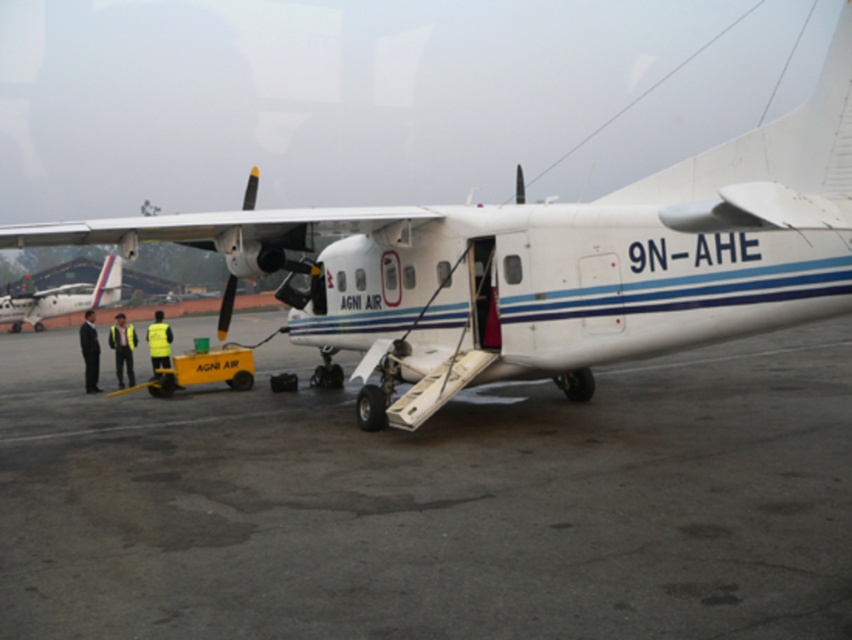
Can you confirm if white matte airplane at center is thinner than yellow reflective vest at center?

In fact, white matte airplane at center might be wider than yellow reflective vest at center.

Is white matte airplane at center to the right of yellow reflective vest at center from the viewer's perspective?

Yes, white matte airplane at center is to the right of yellow reflective vest at center.

Between point (709, 250) and point (165, 337), which one is positioned behind?

The point (165, 337) is more distant.

Locate an element on the screen. This screenshot has height=640, width=852. white matte airplane at center is located at coordinates (545, 262).

Does yellow reflective vest at left have a greater height compared to black suit at left?

In fact, yellow reflective vest at left may be shorter than black suit at left.

Is yellow reflective vest at left to the right of black suit at left from the viewer's perspective?

Correct, you'll find yellow reflective vest at left to the right of black suit at left.

Is point (117, 344) farther from camera compared to point (84, 348)?

That is True.

At what (x,y) coordinates should I click in order to perform the action: click on yellow reflective vest at left. Please return your answer as a coordinate pair (x, y). The height and width of the screenshot is (640, 852). Looking at the image, I should click on (122, 348).

In the scene shown: Does gray asphalt tarmac at center come behind yellow reflective vest at center?

That is False.

Between point (593, 516) and point (157, 337), which one is positioned in front?

Point (593, 516) is in front.

Which is behind, point (433, 500) or point (157, 352)?

The point (157, 352) is more distant.

This screenshot has width=852, height=640. I want to click on gray asphalt tarmac at center, so click(x=433, y=502).